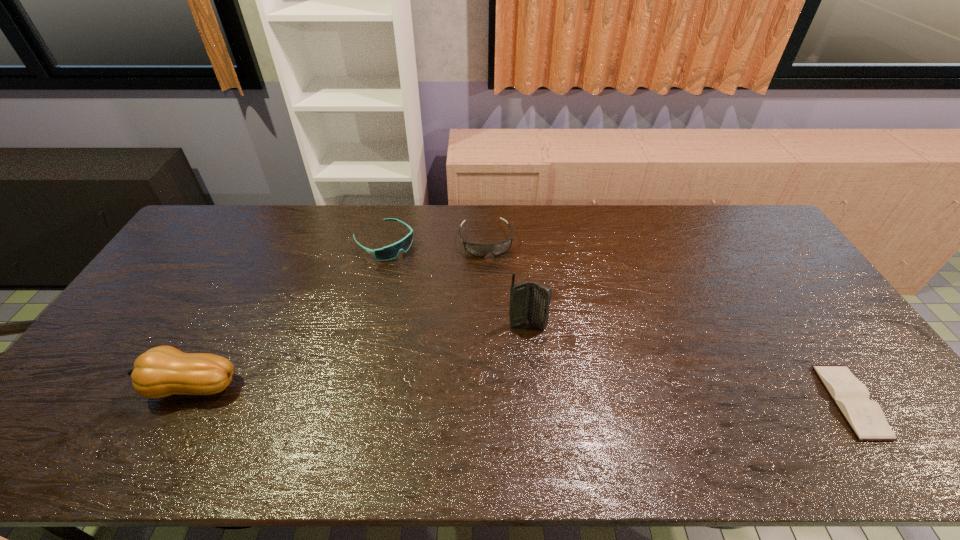
Locate an element on the screen. The width and height of the screenshot is (960, 540). the second tallest object is located at coordinates (162, 371).

Find the location of a particular element. gourd is located at coordinates (162, 371).

In order to click on diary in this screenshot , I will do `click(865, 417)`.

You are a GUI agent. You are given a task and a screenshot of the screen. Output one action in this format:
    pyautogui.click(x=<x>, y=<y>)
    Task: Click on the rightmost object
    This screenshot has height=540, width=960.
    Given the screenshot: What is the action you would take?
    pyautogui.click(x=865, y=417)

Identify the location of goggles. (480, 250).

This screenshot has height=540, width=960. What are the coordinates of `the third nearest object` in the screenshot? It's located at (529, 301).

Identify the location of the tallest object. This screenshot has height=540, width=960. pyautogui.click(x=529, y=301).

Where is `the fourth object from right to left`? The width and height of the screenshot is (960, 540). the fourth object from right to left is located at coordinates (389, 252).

At what (x,y) coordinates should I click in order to perform the action: click on free space located 0.050m on the stem side of the fourth shortest object. Please return your answer as a coordinate pair (x, y). Looking at the image, I should click on (120, 387).

Locate an element on the screen. The width and height of the screenshot is (960, 540). vacant space positioned 0.090m on the left of the rightmost object is located at coordinates (797, 401).